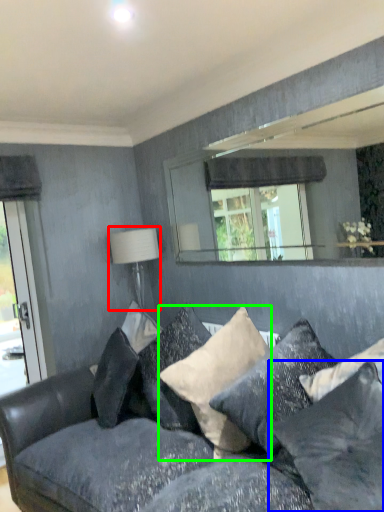
Question: Based on their relative distances, which object is farther from table lamp (highlighted by a red box)? Choose from pillow (highlighted by a blue box) and pillow (highlighted by a green box).

Choices:
 (A) pillow
 (B) pillow

Answer: (A)